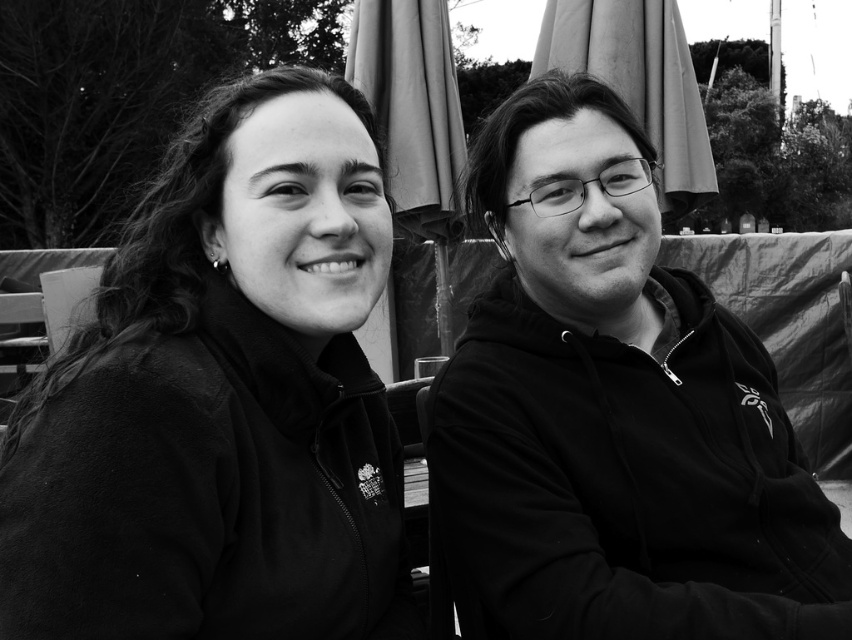
Question: Which of the following is the closest to the observer?

Choices:
 (A) black zip-up hoodie at center
 (B) matte black jacket at left

Answer: (B)

Question: Is matte black jacket at left bigger than black zip-up hoodie at center?

Choices:
 (A) yes
 (B) no

Answer: (B)

Question: Which point appears farthest from the camera in this image?

Choices:
 (A) (344, 100)
 (B) (678, 289)

Answer: (B)

Question: Is matte black jacket at left above black zip-up hoodie at center?

Choices:
 (A) no
 (B) yes

Answer: (A)

Question: Is matte black jacket at left smaller than black zip-up hoodie at center?

Choices:
 (A) yes
 (B) no

Answer: (A)